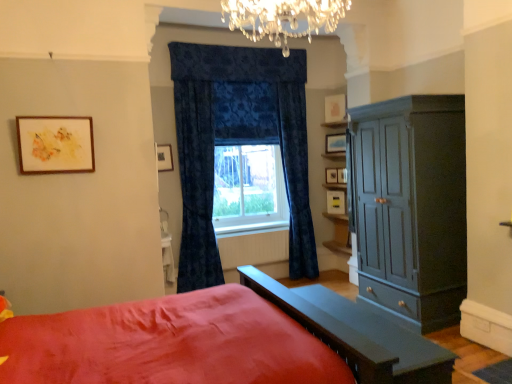
Question: From the image's perspective, is white glossy table at lower center, acting as the 2th table starting from the right, above white painted radiator at center?

Choices:
 (A) no
 (B) yes

Answer: (B)

Question: Considering the relative positions of white glossy table at lower center, which is the second table from front to back, and white painted radiator at center in the image provided, is white glossy table at lower center, which is the second table from front to back, to the right of white painted radiator at center from the viewer's perspective?

Choices:
 (A) yes
 (B) no

Answer: (B)

Question: Is there a large distance between white glossy table at lower center, which is the second table from front to back, and white painted radiator at center?

Choices:
 (A) yes
 (B) no

Answer: (B)

Question: Can you confirm if white glossy table at lower center, acting as the 2th table starting from the right, is smaller than white painted radiator at center?

Choices:
 (A) yes
 (B) no

Answer: (B)

Question: Could you tell me if white glossy table at lower center, acting as the 2th table starting from the right, is turned towards white painted radiator at center?

Choices:
 (A) no
 (B) yes

Answer: (A)

Question: Relative to wooden picture frame at upper center, which is the first picture frame from back to front, is velvet blue curtain at center, the 1th curtain when ordered from left to right, in front or behind?

Choices:
 (A) behind
 (B) front

Answer: (B)

Question: Is velvet blue curtain at center, positioned as the 2th curtain in right-to-left order, inside the boundaries of wooden picture frame at upper center, positioned as the 4th picture frame in right-to-left order, or outside?

Choices:
 (A) inside
 (B) outside

Answer: (B)

Question: Based on their sizes in the image, would you say velvet blue curtain at center, positioned as the 2th curtain in right-to-left order, is bigger or smaller than wooden picture frame at upper center, which is the first picture frame from back to front?

Choices:
 (A) small
 (B) big

Answer: (B)

Question: Does point (205, 94) appear closer or farther from the camera than point (325, 168)?

Choices:
 (A) closer
 (B) farther

Answer: (A)

Question: Considering the positions of velvet blue curtain at center, which is counted as the 2th curtain, starting from the left, and matte black picture frame at upper center, the 2th picture frame in the left-to-right sequence, in the image, is velvet blue curtain at center, which is counted as the 2th curtain, starting from the left, wider or thinner than matte black picture frame at upper center, the 2th picture frame in the left-to-right sequence,?

Choices:
 (A) thin
 (B) wide

Answer: (B)

Question: Which is correct: velvet blue curtain at center, which is counted as the 2th curtain, starting from the left, is inside matte black picture frame at upper center, the fifth picture frame when ordered from right to left, or outside of it?

Choices:
 (A) outside
 (B) inside

Answer: (A)

Question: From a real-world perspective, is velvet blue curtain at center, the 1th curtain from the right, physically located above or below matte black picture frame at upper center, the 5th picture frame when ordered from back to front?

Choices:
 (A) above
 (B) below

Answer: (B)

Question: Is point (305, 201) positioned closer to the camera than point (167, 165)?

Choices:
 (A) farther
 (B) closer

Answer: (A)

Question: Which is correct: wooden picture frame at upper center, the 3th picture frame when ordered from left to right, is inside matte gray cabinet at right, or outside of it?

Choices:
 (A) outside
 (B) inside

Answer: (A)

Question: In the image, is wooden picture frame at upper center, which is the first picture frame from back to front, positioned in front of or behind matte gray cabinet at right?

Choices:
 (A) front
 (B) behind

Answer: (B)